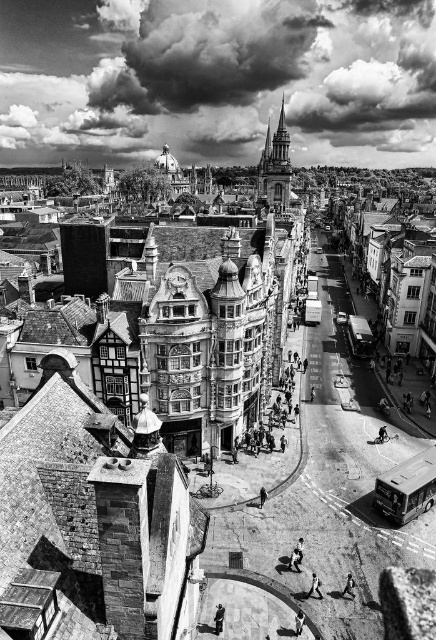
Question: Does light gray fabric pants at lower center have a smaller size compared to smooth skin person at center?

Choices:
 (A) no
 (B) yes

Answer: (A)

Question: Among these points, which one is nearest to the camera?

Choices:
 (A) tap(351, 573)
 (B) tap(316, 593)

Answer: (B)

Question: Among these objects, which one is farthest from the camera?

Choices:
 (A) light gray fabric pants at lower center
 (B) smooth skin person at center

Answer: (B)

Question: Does light gray fabric pants at lower center appear over smooth skin person at center?

Choices:
 (A) no
 (B) yes

Answer: (B)

Question: Among these points, which one is nearest to the camera?

Choices:
 (A) (313, 589)
 (B) (350, 579)

Answer: (A)

Question: Is light gray fabric pants at lower center to the left of smooth skin person at center from the viewer's perspective?

Choices:
 (A) no
 (B) yes

Answer: (B)